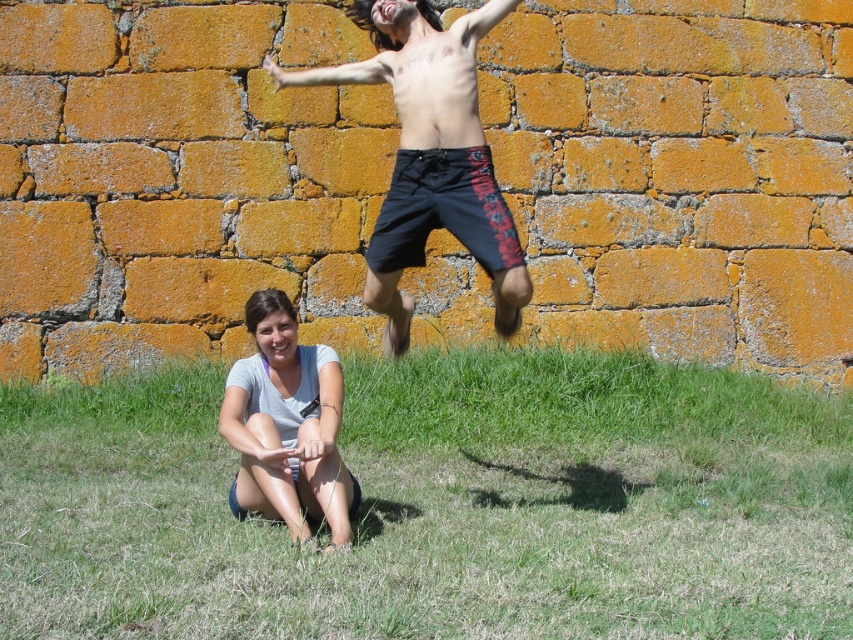
Question: Which point is closer to the camera taking this photo?

Choices:
 (A) (605, 502)
 (B) (242, 436)

Answer: (B)

Question: Which object is positioned closest to the green grass at lower center?

Choices:
 (A) gray cotton shirt at lower left
 (B) dark blue shorts at upper center

Answer: (A)

Question: Does green grass at lower center have a smaller size compared to gray cotton shirt at lower left?

Choices:
 (A) yes
 (B) no

Answer: (A)

Question: Estimate the real-world distances between objects in this image. Which object is closer to the gray cotton shirt at lower left?

Choices:
 (A) dark blue shorts at upper center
 (B) green grass at lower center

Answer: (B)

Question: Is green grass at lower center thinner than dark blue shorts at upper center?

Choices:
 (A) yes
 (B) no

Answer: (A)

Question: Considering the relative positions of dark blue shorts at upper center and gray cotton shirt at lower left in the image provided, where is dark blue shorts at upper center located with respect to gray cotton shirt at lower left?

Choices:
 (A) above
 (B) below

Answer: (A)